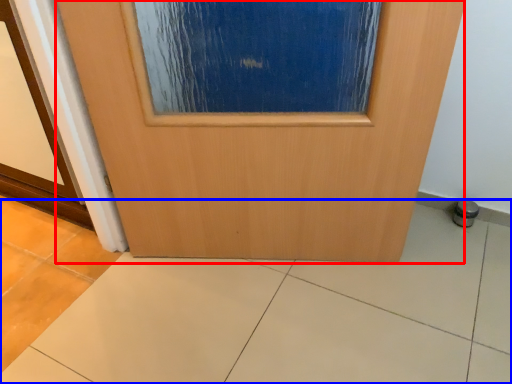
Question: Which object appears farthest to the camera in this image, door (highlighted by a red box) or ceramic tile (highlighted by a blue box)?

Choices:
 (A) door
 (B) ceramic tile

Answer: (A)